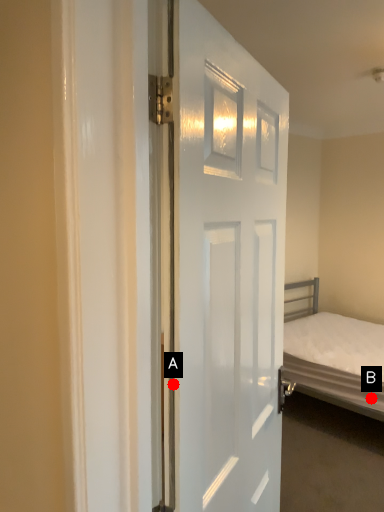
Question: Two points are circled on the image, labeled by A and B beside each circle. Which point is farther from the camera taking this photo?

Choices:
 (A) A is further
 (B) B is further

Answer: (B)